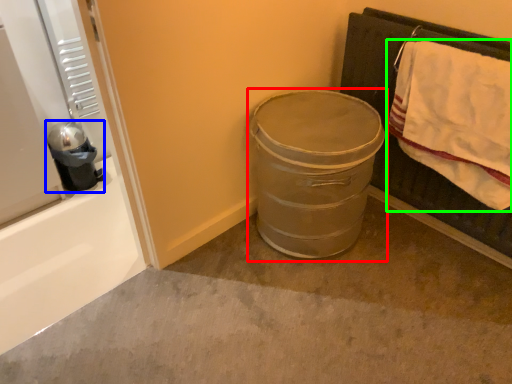
Question: Which object is positioned closest to trash bin/can (highlighted by a red box)? Select from appliance (highlighted by a blue box) and bath towel (highlighted by a green box).

Choices:
 (A) appliance
 (B) bath towel

Answer: (B)